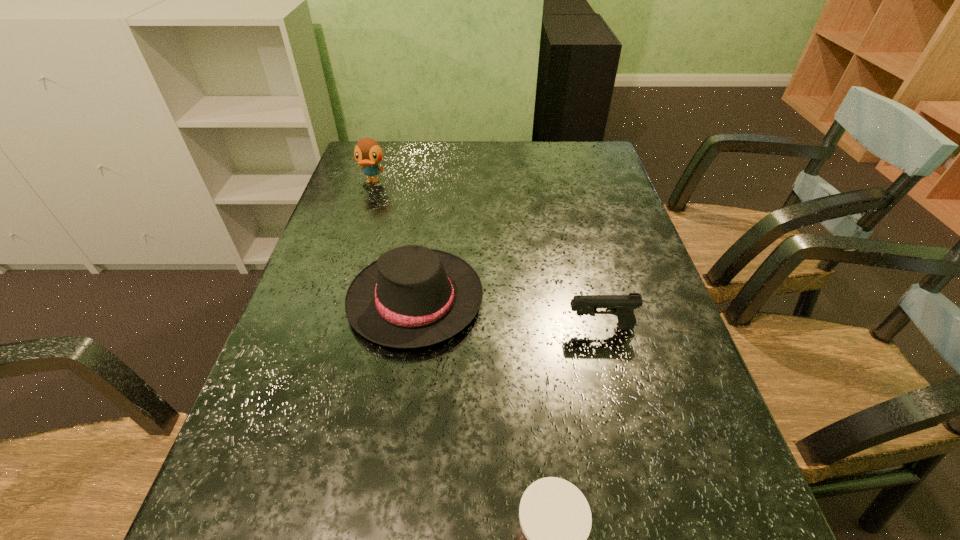
Find the location of a particular element. Image resolution: width=960 pixels, height=540 pixels. free space that satisfies the following two spatial constraints: 1. on the front-facing side of the tallest object; 2. on the left side of the dress hat is located at coordinates (334, 300).

Locate an element on the screen. This screenshot has height=540, width=960. free space in the image that satisfies the following two spatial constraints: 1. on the front-facing side of the tallest object; 2. on the left side of the dress hat is located at coordinates (334, 300).